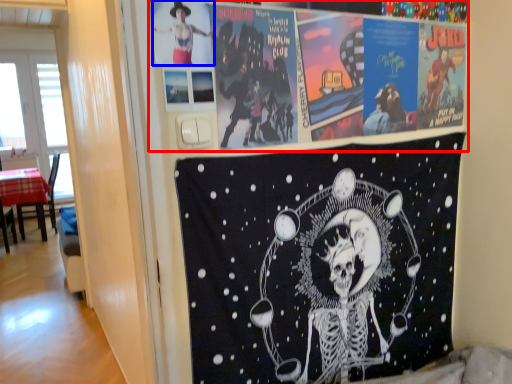
Question: Which of the following is the farthest to the observer, poster (highlighted by a red box) or person (highlighted by a blue box)?

Choices:
 (A) poster
 (B) person

Answer: (A)